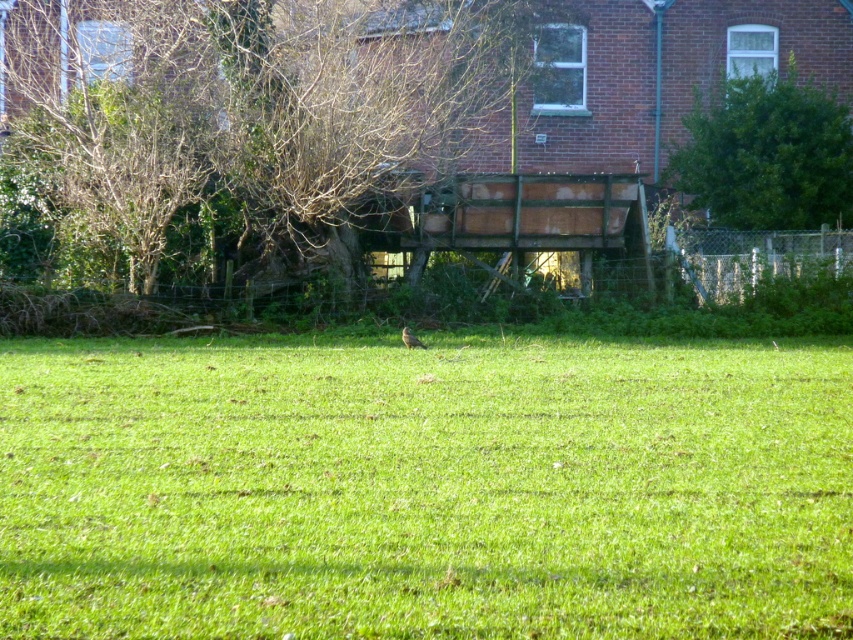
Question: Estimate the real-world distances between objects in this image. Which object is closer to the brown wood tree at upper center?

Choices:
 (A) brown feathered bird at center
 (B) green grass at center
 (C) green leafy tree at upper right

Answer: (A)

Question: Considering the real-world distances, which object is closest to the brown feathered bird at center?

Choices:
 (A) brown wood tree at upper center
 (B) green leafy tree at upper right

Answer: (A)

Question: Does green leafy tree at upper right appear under brown feathered bird at center?

Choices:
 (A) no
 (B) yes

Answer: (A)

Question: Does green grass at center have a greater width compared to green leafy tree at upper right?

Choices:
 (A) yes
 (B) no

Answer: (A)

Question: Does brown wood tree at upper center have a smaller size compared to green leafy tree at upper right?

Choices:
 (A) no
 (B) yes

Answer: (A)

Question: Considering the real-world distances, which object is farthest from the brown wood tree at upper center?

Choices:
 (A) green leafy tree at upper right
 (B) green grass at center

Answer: (A)